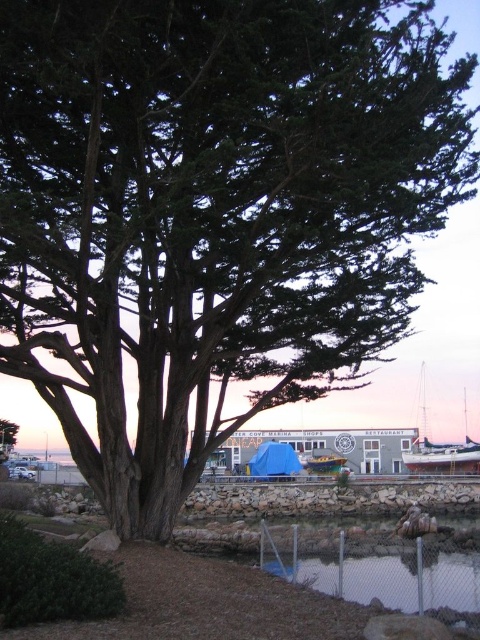
You are a photographer standing at the edge of the clear water at lower center, aiming to capture the white glossy boat at lower right. Your camera has a maximum zoom range of 50 meters. Can you clearly photograph the boat without moving closer?

The distance between the clear water at lower center and the white glossy boat at lower right is 44.31 meters, which is within the camera maximum zoom range of 50 meters. Therefore, you can clearly photograph the boat without moving closer.

Looking at this image, you are standing at the center of the image and want to place a new decorative rock exactly at the same 2D location as the green plastic boat at center. What are the coordinates where you should place the rock?

The coordinates for the green plastic boat at center are at point (x=324, y=464). Therefore, you should place the decorative rock at the same coordinates, which are 0.725 and 0.677.

You are a photographer trying to capture the green plastic boat at center and the green rough bark tree at center in the same frame. Which object should you move your camera to the left to include in the shot?

The green plastic boat at center is positioned on the right side of green rough bark tree at center. To include both in the shot, you should move your camera to the left to capture the green plastic boat at center.